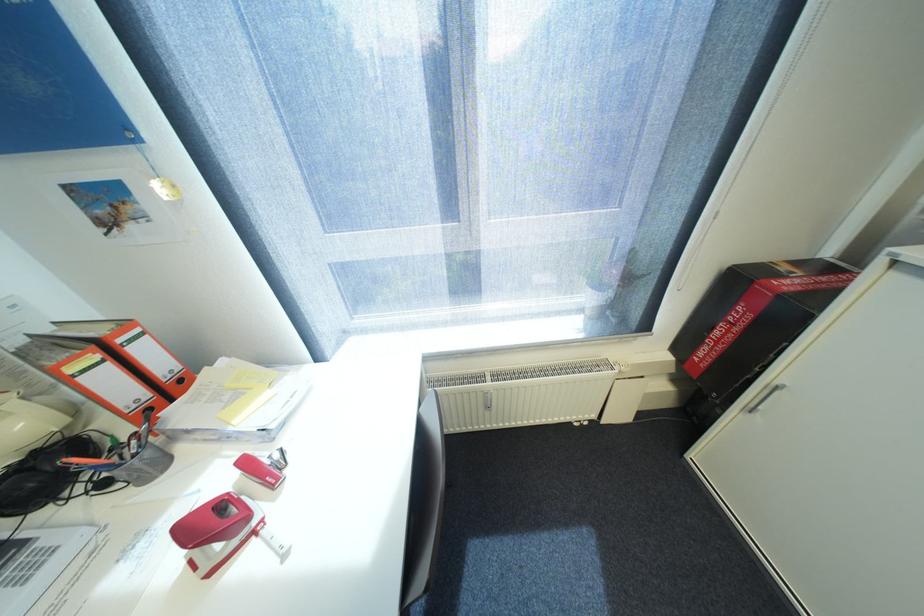
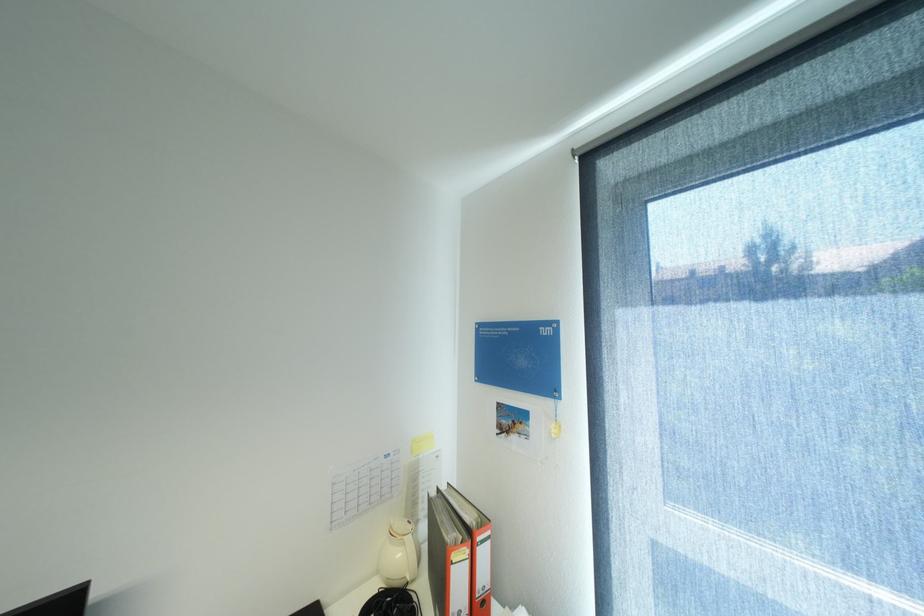
Find the pixel in the second image that matches point 30,424 in the first image.

(407, 554)